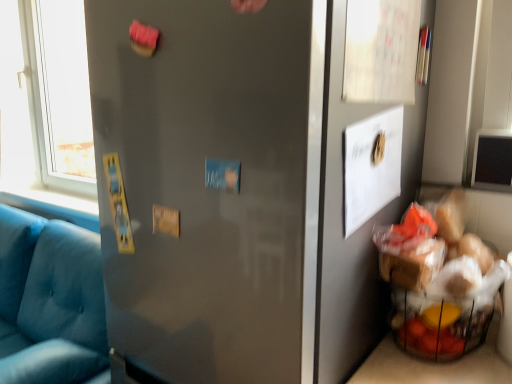
The image size is (512, 384). Describe the element at coordinates (210, 186) in the screenshot. I see `matte gray door at upper left` at that location.

This screenshot has height=384, width=512. I want to click on matte gray door at upper left, so click(210, 186).

What do you see at coordinates (50, 302) in the screenshot? I see `matte blue fabric couch at left` at bounding box center [50, 302].

This screenshot has width=512, height=384. I want to click on matte blue fabric couch at left, so click(x=50, y=302).

What is the approximate height of matte blue fabric couch at left?

matte blue fabric couch at left is 37.69 inches in height.

Locate an element on the screen. matte gray door at upper left is located at coordinates (210, 186).

Can you confirm if matte blue fabric couch at left is positioned to the right of matte gray door at upper left?

No, matte blue fabric couch at left is not to the right of matte gray door at upper left.

Is matte blue fabric couch at left positioned in front of matte gray door at upper left?

No, it is behind matte gray door at upper left.

Which point is more forward, (32, 353) or (298, 17)?

The point (298, 17) is in front.

From the image's perspective, which is above, matte blue fabric couch at left or matte gray door at upper left?

matte gray door at upper left is shown above in the image.

From a real-world perspective, which is physically below, matte blue fabric couch at left or matte gray door at upper left?

In real-world perspective, matte blue fabric couch at left is lower.

Is matte blue fabric couch at left thinner than matte gray door at upper left?

In fact, matte blue fabric couch at left might be wider than matte gray door at upper left.

Is matte blue fabric couch at left shorter than matte gray door at upper left?

In fact, matte blue fabric couch at left may be taller than matte gray door at upper left.

Is matte blue fabric couch at left bigger than matte gray door at upper left?

Yes.

Do you think matte blue fabric couch at left is within matte gray door at upper left, or outside of it?

matte blue fabric couch at left cannot be found inside matte gray door at upper left.

Is matte blue fabric couch at left far away from matte gray door at upper left?

No, matte blue fabric couch at left is not far away from matte gray door at upper left.

Could you tell me if matte blue fabric couch at left is facing matte gray door at upper left?

No, matte blue fabric couch at left is not turned towards matte gray door at upper left.

What's the angular difference between matte blue fabric couch at left and matte gray door at upper left's facing directions?

The facing directions of matte blue fabric couch at left and matte gray door at upper left are 1.86 degrees apart.

Locate an element on the screen. This screenshot has width=512, height=384. door located above the matte blue fabric couch at left (from the image's perspective) is located at coordinates (210, 186).

Considering the relative positions of matte gray door at upper left and matte blue fabric couch at left in the image provided, is matte gray door at upper left to the right of matte blue fabric couch at left from the viewer's perspective?

Yes, matte gray door at upper left is to the right of matte blue fabric couch at left.

Considering the positions of objects matte gray door at upper left and matte blue fabric couch at left in the image provided, who is in front, matte gray door at upper left or matte blue fabric couch at left?

matte gray door at upper left is in front.

Which is farther from the camera, (111,323) or (94,335)?

The point (94,335) is farther from the camera.

From the image's perspective, would you say matte gray door at upper left is positioned over matte blue fabric couch at left?

Yes.

From a real-world perspective, which object stands above the other?

matte gray door at upper left.

Which object is wider, matte gray door at upper left or matte blue fabric couch at left?

matte blue fabric couch at left is wider.

Can you confirm if matte gray door at upper left is shorter than matte blue fabric couch at left?

Yes.

Considering the sizes of matte gray door at upper left and matte blue fabric couch at left in the image, is matte gray door at upper left bigger or smaller than matte blue fabric couch at left?

In the image, matte gray door at upper left appears to be smaller than matte blue fabric couch at left.

Is matte gray door at upper left located outside matte blue fabric couch at left?

Yes, matte gray door at upper left is not within matte blue fabric couch at left.

Is matte gray door at upper left next to matte blue fabric couch at left and touching it?

No, matte gray door at upper left is not beside matte blue fabric couch at left.

Is matte gray door at upper left turned away from matte blue fabric couch at left?

matte gray door at upper left does not have its back to matte blue fabric couch at left.

Can you tell me how much matte gray door at upper left and matte blue fabric couch at left differ in facing direction?

1.86 degrees.

Identify the location of studio couch beneath the matte gray door at upper left (from a real-world perspective). (50, 302).

Find the location of a particular element. This screenshot has width=512, height=384. door above the matte blue fabric couch at left (from a real-world perspective) is located at coordinates (210, 186).

This screenshot has height=384, width=512. In order to click on door in front of the matte blue fabric couch at left in this screenshot , I will do `click(210, 186)`.